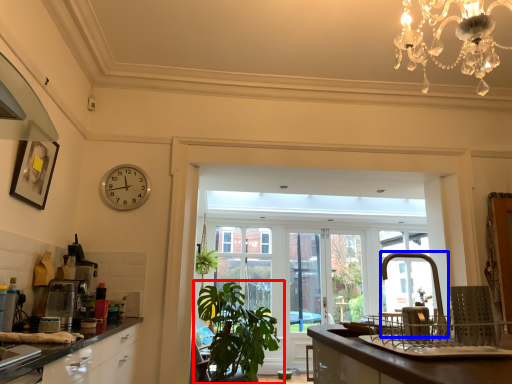
Question: Among these objects, which one is nearest to the camera, houseplant (highlighted by a red box) or faucet (highlighted by a blue box)?

Choices:
 (A) houseplant
 (B) faucet

Answer: (B)